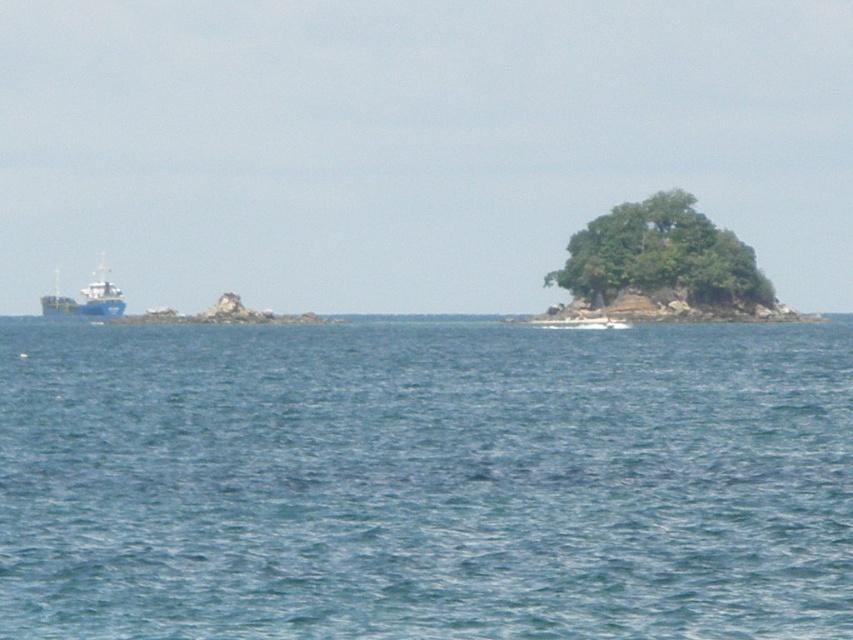
What is the exact coordinate of the blue water at center?

The blue water at center is located at point (x=425, y=481).

You are on a boat and want to navigate to the island with the large tree. Based on the scene, which direction should you steer towards to reach the island with the large tree, considering the position of the blue matte boat at left and the blue water at center?

The blue water at center is closer to the viewer than the blue matte boat at left, so you should steer towards the direction of the blue water at center to reach the island with the large tree.